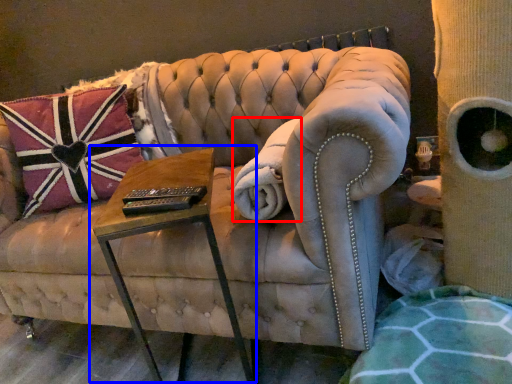
Question: Which point is closer to the camera, blanket (highlighted by a red box) or table (highlighted by a blue box)?

Choices:
 (A) blanket
 (B) table

Answer: (B)